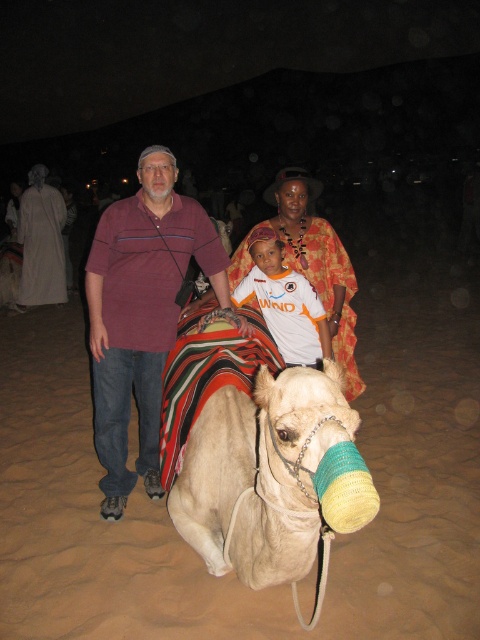
You are standing in the desert scene described. You need to place a small tent between the white sand at lower center and the maroon cotton shirt at center. Which object should the tent be closer to, and why?

The tent should be closer to the maroon cotton shirt at center because the white sand at lower center is wider than the maroon cotton shirt at center, so placing it near the narrower object ensures stability and visibility.

You are standing in the desert scene shown in the image. You want to place a small flag exactly at the location of the white sand at lower center. What are the coordinates where you should place the flag?

The coordinates for the white sand at lower center are 0.808 on the x axis and 0.196 on the y axis.

You are standing in the desert at night and see the light beige fabric camel at center. Can you determine its exact location based on the coordinates provided?

The light beige fabric camel at center is located at point (247, 449).